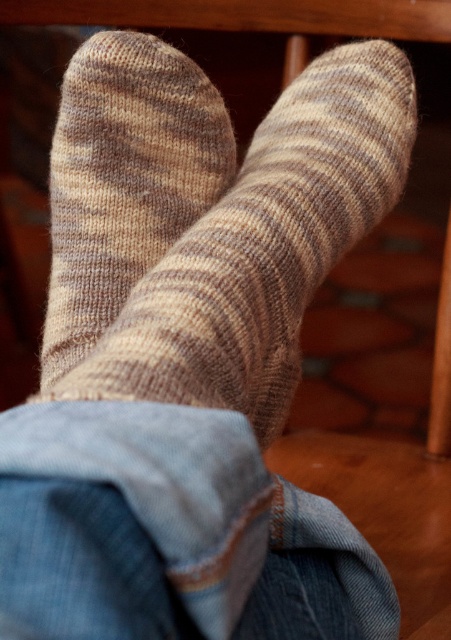
Who is shorter, knit woolen socks at center or denim at lower left?

denim at lower left is shorter.

Who is taller, knit woolen socks at center or denim at lower left?

knit woolen socks at center is taller.

At what (x,y) coordinates should I click in order to perform the action: click on knit woolen socks at center. Please return your answer as a coordinate pair (x, y). Looking at the image, I should click on (207, 220).

Who is more distant from viewer, (82, 61) or (97, 432)?

Positioned behind is point (82, 61).

Does knit brown socks at center have a greater height compared to denim at lower left?

Indeed, knit brown socks at center has a greater height compared to denim at lower left.

The width and height of the screenshot is (451, 640). Describe the element at coordinates (124, 179) in the screenshot. I see `knit brown socks at center` at that location.

This screenshot has height=640, width=451. Find the location of `knit brown socks at center`. knit brown socks at center is located at coordinates (124, 179).

Is point (257, 172) more distant than point (176, 120)?

Yes, point (257, 172) is behind point (176, 120).

I want to click on knit woolen socks at center, so click(x=207, y=220).